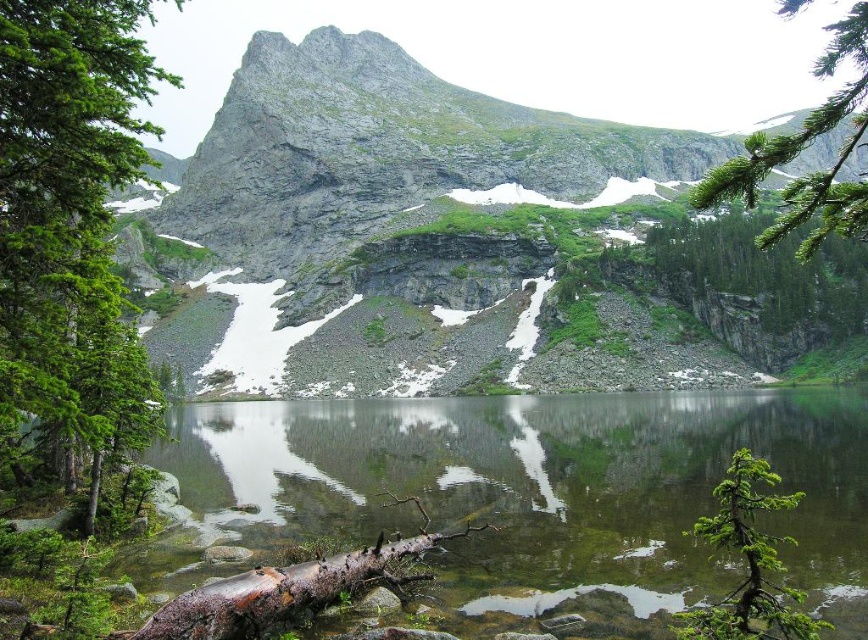
Is point (33, 141) positioned before point (850, 109)?

Yes.

I want to click on green matte tree at left, so click(x=69, y=225).

Describe the element at coordinates (286, 589) in the screenshot. The height and width of the screenshot is (640, 868). I see `rusty wood log at lower center` at that location.

Which of these two, rusty wood log at lower center or green matte tree at lower right, stands taller?

Standing taller between the two is green matte tree at lower right.

Identify the location of rusty wood log at lower center. pyautogui.click(x=286, y=589).

Does point (412, 147) lie behind point (755, 154)?

Yes, point (412, 147) is behind point (755, 154).

This screenshot has width=868, height=640. I want to click on gray rocky mountain at center, so click(x=376, y=170).